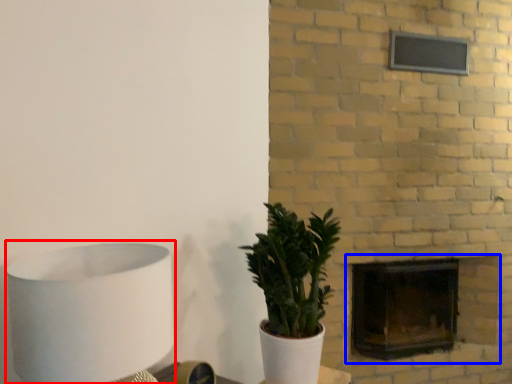
Question: Which object appears closest to the camera in this image, table lamp (highlighted by a red box) or fireplace (highlighted by a blue box)?

Choices:
 (A) table lamp
 (B) fireplace

Answer: (A)